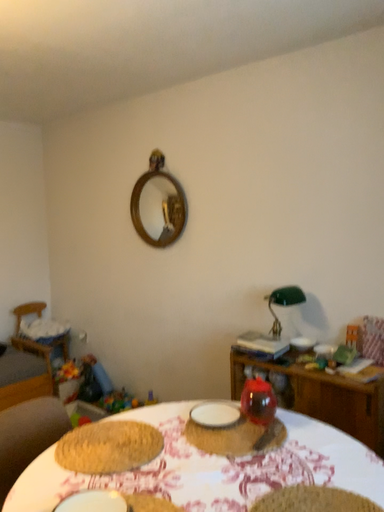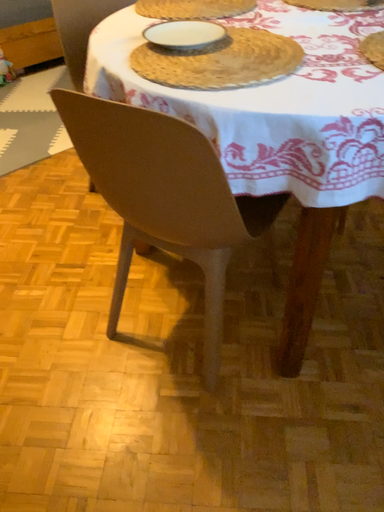
Question: Which way did the camera rotate in the video?

Choices:
 (A) rotated downward
 (B) rotated upward

Answer: (A)